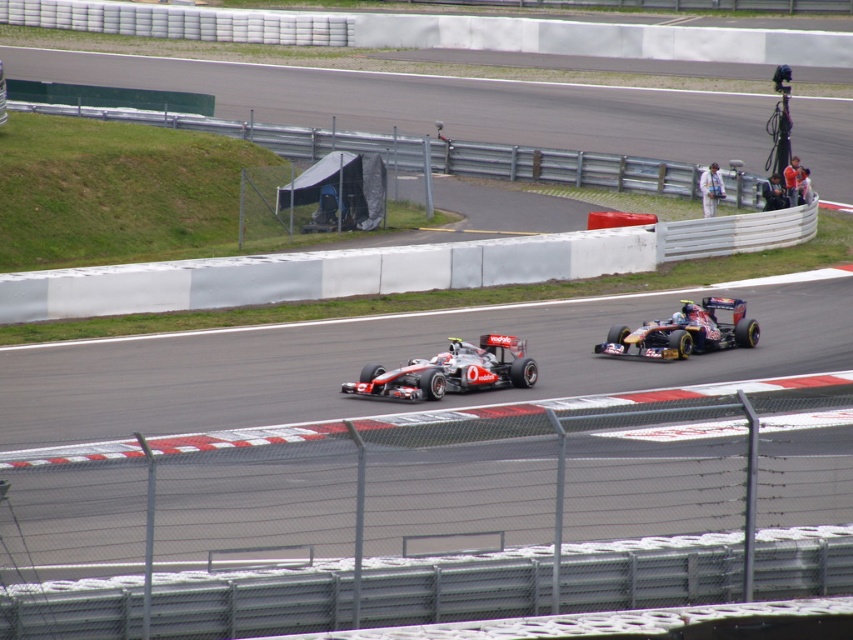
You are a race official measuring the distance between the two race cars during a safety inspection. According to the image, how far apart are the silver metallic race car at center and the shiny metallic race car at center?

The distance between the silver metallic race car at center and the shiny metallic race car at center is 3.10 meters.

You are a race commentator watching the Formula One race. You notice two cars, the silver metallic race car at center and the shiny metallic race car at center, racing closely. Which car is leading the race at this moment?

The silver metallic race car at center is leading the race because it is positioned in front of the shiny metallic race car at center.